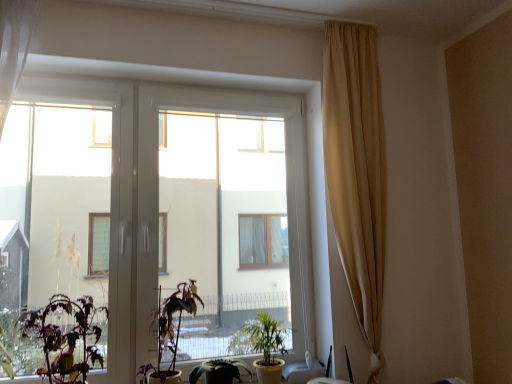
Question: Which direction should I rotate to face green matte plant at lower center, the second houseplant viewed from the right, — up or down?

Choices:
 (A) down
 (B) up

Answer: (A)

Question: Can you confirm if green matte plant at lower center, the second houseplant viewed from the right, is shorter than purple matte plant at center, which is counted as the 2th houseplant, starting from the left?

Choices:
 (A) no
 (B) yes

Answer: (B)

Question: Considering the relative sizes of green matte plant at lower center, the second houseplant viewed from the right, and purple matte plant at center, which is the third houseplant from right to left, in the image provided, is green matte plant at lower center, the second houseplant viewed from the right, taller than purple matte plant at center, which is the third houseplant from right to left,?

Choices:
 (A) no
 (B) yes

Answer: (A)

Question: Can you confirm if green matte plant at lower center, the second houseplant viewed from the right, is wider than purple matte plant at center, which is counted as the 2th houseplant, starting from the left?

Choices:
 (A) yes
 (B) no

Answer: (B)

Question: Considering the relative sizes of green matte plant at lower center, the second houseplant viewed from the right, and purple matte plant at center, which is the third houseplant from right to left, in the image provided, is green matte plant at lower center, the second houseplant viewed from the right, bigger than purple matte plant at center, which is the third houseplant from right to left,?

Choices:
 (A) yes
 (B) no

Answer: (B)

Question: Is green matte plant at lower center, the second houseplant viewed from the right, smaller than purple matte plant at center, which is counted as the 2th houseplant, starting from the left?

Choices:
 (A) no
 (B) yes

Answer: (B)

Question: Is green matte plant at lower center, which ranks as the 3th houseplant in left-to-right order, oriented towards purple matte plant at center, which is the third houseplant from right to left?

Choices:
 (A) no
 (B) yes

Answer: (A)

Question: Does green matte plant at center, marked as the first houseplant in a right-to-left arrangement, have a larger size compared to transparent glass window at center?

Choices:
 (A) yes
 (B) no

Answer: (B)

Question: Considering the relative sizes of green matte plant at center, marked as the first houseplant in a right-to-left arrangement, and transparent glass window at center in the image provided, is green matte plant at center, marked as the first houseplant in a right-to-left arrangement, smaller than transparent glass window at center?

Choices:
 (A) no
 (B) yes

Answer: (B)

Question: Is green matte plant at center, positioned as the 4th houseplant in left-to-right order, positioned before transparent glass window at center?

Choices:
 (A) yes
 (B) no

Answer: (B)

Question: Can you confirm if green matte plant at center, positioned as the 4th houseplant in left-to-right order, is positioned to the left of transparent glass window at center?

Choices:
 (A) no
 (B) yes

Answer: (A)

Question: Does green matte plant at center, marked as the first houseplant in a right-to-left arrangement, appear on the right side of transparent glass window at center?

Choices:
 (A) yes
 (B) no

Answer: (A)

Question: Is green matte plant at center, marked as the first houseplant in a right-to-left arrangement, thinner than transparent glass window at center?

Choices:
 (A) yes
 (B) no

Answer: (B)

Question: Would you say transparent glass window at center is outside green matte plant at lower left, positioned as the 4th houseplant in right-to-left order?

Choices:
 (A) yes
 (B) no

Answer: (A)